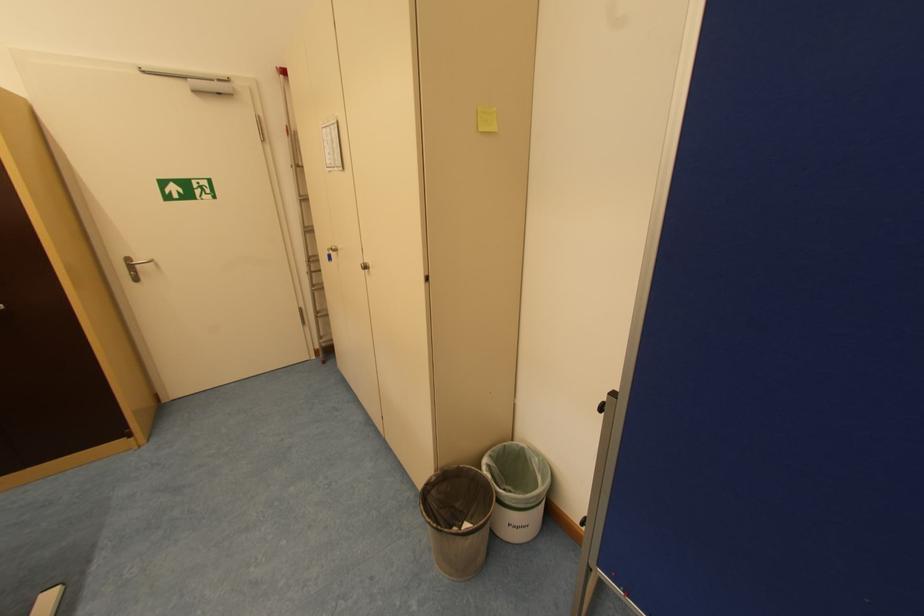
Find where to lift the white trash can. Please return your answer as a coordinate pair (x, y).

(517, 488)